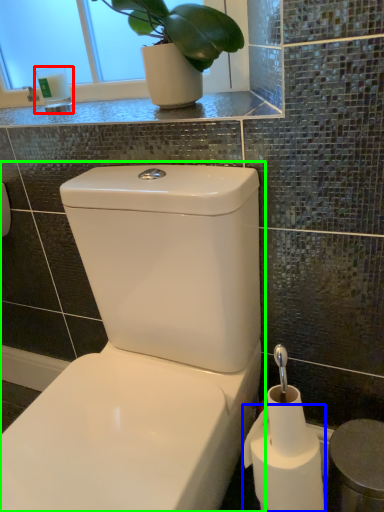
Question: Which is nearer to the toiletry (highlighted by a red box)? toilet paper (highlighted by a blue box) or toilet (highlighted by a green box).

Choices:
 (A) toilet paper
 (B) toilet

Answer: (B)